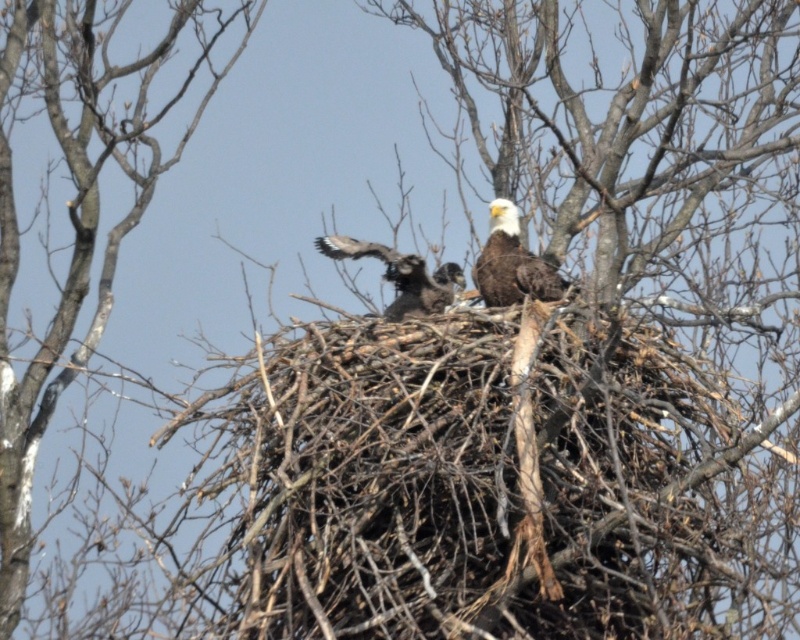
Is white feathered eagle at center positioned behind dark brown feathers at center?

That is True.

Which is behind, point (498, 294) or point (366, 248)?

The point (498, 294) is behind.

The image size is (800, 640). Describe the element at coordinates (512, 262) in the screenshot. I see `white feathered eagle at center` at that location.

In order to click on white feathered eagle at center in this screenshot , I will do `click(512, 262)`.

Who is more forward, [61,132] or [546,291]?

Point [546,291]

From the picture: Between bare branches at center and white feathered eagle at center, which one appears on the left side from the viewer's perspective?

Positioned to the left is bare branches at center.

You are a GUI agent. You are given a task and a screenshot of the screen. Output one action in this format:
    pyautogui.click(x=<x>, y=<y>)
    Task: Click on the bare branches at center
    Image resolution: width=800 pixels, height=640 pixels.
    Given the screenshot: What is the action you would take?
    pyautogui.click(x=78, y=218)

Between bare branches at center and dark brown feathers at center, which one is positioned higher?

Positioned higher is bare branches at center.

Can you confirm if bare branches at center is shorter than dark brown feathers at center?

No.

I want to click on bare branches at center, so click(78, 218).